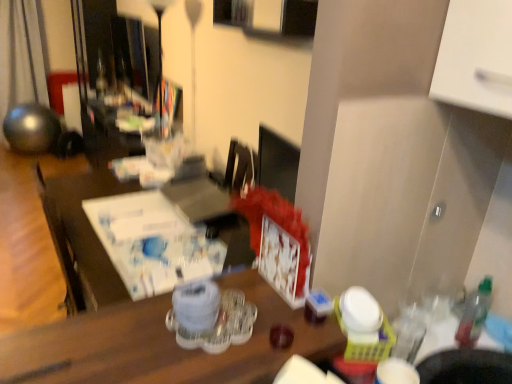
What do you see at coordinates (162, 345) in the screenshot?
I see `clear plastic tray at center` at bounding box center [162, 345].

Describe the element at coordinates (31, 128) in the screenshot. I see `metallic sphere at left` at that location.

Locate an element on the screen. The width and height of the screenshot is (512, 384). clear plastic tray at center is located at coordinates (162, 345).

Considering the relative sizes of translucent plastic bottle at right and white paper at center in the image provided, is translucent plastic bottle at right thinner than white paper at center?

Yes, translucent plastic bottle at right is thinner than white paper at center.

Would you say white paper at center is part of translucent plastic bottle at right's contents?

No, white paper at center is not inside translucent plastic bottle at right.

Looking at this image, from a real-world perspective, is translucent plastic bottle at right positioned above or below white paper at center?

Clearly, from a real-world perspective, translucent plastic bottle at right is above white paper at center.

How different are the orientations of translucent plastic bottle at right and white paper at center in degrees?

The angle between the facing direction of translucent plastic bottle at right and the facing direction of white paper at center is 168 degrees.

Which object is further away from the camera taking this photo, metallic sphere at left or white paper at center?

metallic sphere at left.

Between metallic sphere at left and white paper at center, which one has larger size?

Bigger between the two is metallic sphere at left.

From a real-world perspective, is metallic sphere at left positioned above or below white paper at center?

metallic sphere at left is below white paper at center.

You are a GUI agent. You are given a task and a screenshot of the screen. Output one action in this format:
    pyautogui.click(x=<x>, y=<y>)
    Task: Click on the ball behind the white paper at center
    Image resolution: width=512 pixels, height=384 pixels.
    Given the screenshot: What is the action you would take?
    pyautogui.click(x=31, y=128)

In terms of width, does white paper at center look wider or thinner when compared to metallic sphere at left?

Clearly, white paper at center has more width compared to metallic sphere at left.

From the image's perspective, relative to metallic sphere at left, is white paper at center above or below?

Based on their image positions, white paper at center is located beneath metallic sphere at left.

Would you say white paper at center is a long distance from metallic sphere at left?

That's right, there is a large distance between white paper at center and metallic sphere at left.

Which is behind, metallic sphere at left or translucent plastic bottle at right?

metallic sphere at left is further away from the camera.

Is metallic sphere at left thinner than translucent plastic bottle at right?

No, metallic sphere at left is not thinner than translucent plastic bottle at right.

Is metallic sphere at left turned away from translucent plastic bottle at right?

No, metallic sphere at left is not facing away from translucent plastic bottle at right.

Is translucent plastic bottle at right inside metallic sphere at left?

No, translucent plastic bottle at right is not inside metallic sphere at left.

Considering the relative positions of clear plastic tray at center and white paper at center in the image provided, is clear plastic tray at center behind white paper at center?

No, it is in front of white paper at center.

This screenshot has height=384, width=512. I want to click on table below the clear plastic tray at center (from a real-world perspective), so click(83, 237).

From the image's perspective, is clear plastic tray at center on white paper at center?

No, from the image's perspective, clear plastic tray at center is not on top of white paper at center.

From a real-world perspective, between clear plastic tray at center and white paper at center, who is vertically higher?

From a 3D spatial view, clear plastic tray at center is above.

Is metallic sphere at left taller or shorter than clear plastic tray at center?

Clearly, metallic sphere at left is taller compared to clear plastic tray at center.

How many degrees apart are the facing directions of metallic sphere at left and clear plastic tray at center?

The angle between the facing direction of metallic sphere at left and the facing direction of clear plastic tray at center is 90.9 degrees.

Is metallic sphere at left in front of or behind clear plastic tray at center in the image?

Clearly, metallic sphere at left is behind clear plastic tray at center.

Considering the positions of objects metallic sphere at left and clear plastic tray at center in the image provided, who is more to the right, metallic sphere at left or clear plastic tray at center?

From the viewer's perspective, clear plastic tray at center appears more on the right side.

Which of these two, clear plastic tray at center or translucent plastic bottle at right, is bigger?

Bigger between the two is clear plastic tray at center.

Where is `bottle beneath the clear plastic tray at center (from a real-world perspective)`? This screenshot has height=384, width=512. bottle beneath the clear plastic tray at center (from a real-world perspective) is located at coordinates (474, 314).

Between clear plastic tray at center and translucent plastic bottle at right, which one appears on the right side from the viewer's perspective?

From the viewer's perspective, translucent plastic bottle at right appears more on the right side.

Is the position of clear plastic tray at center more distant than that of translucent plastic bottle at right?

No, it is in front of translucent plastic bottle at right.

This screenshot has height=384, width=512. In the image, there is a white paper at center. Identify the location of bottle below it (from the image's perspective). (474, 314).

The height and width of the screenshot is (384, 512). Find the location of `ball directly beneath the white paper at center (from a real-world perspective)`. ball directly beneath the white paper at center (from a real-world perspective) is located at coordinates (31, 128).

When comparing their distances from translucent plastic bottle at right, does white paper at center or clear plastic tray at center seem closer?

Among the two, clear plastic tray at center is located nearer to translucent plastic bottle at right.

Considering their positions, is clear plastic tray at center positioned further to translucent plastic bottle at right than white paper at center?

white paper at center.

When comparing their distances from metallic sphere at left, does translucent plastic bottle at right or white paper at center seem closer?

Based on the image, white paper at center appears to be nearer to metallic sphere at left.

Estimate the real-world distances between objects in this image. Which object is closer to translucent plastic bottle at right, clear plastic tray at center or metallic sphere at left?

clear plastic tray at center is closer to translucent plastic bottle at right.

Looking at the image, which one is located closer to metallic sphere at left, translucent plastic bottle at right or clear plastic tray at center?

clear plastic tray at center lies closer to metallic sphere at left than the other object.

When comparing their distances from metallic sphere at left, does white paper at center or translucent plastic bottle at right seem closer?

white paper at center is closer to metallic sphere at left.

Which object lies further to the anchor point clear plastic tray at center, translucent plastic bottle at right or metallic sphere at left?

Among the two, metallic sphere at left is located further to clear plastic tray at center.

When comparing their distances from clear plastic tray at center, does metallic sphere at left or white paper at center seem closer?

The object closer to clear plastic tray at center is white paper at center.

Image resolution: width=512 pixels, height=384 pixels. I want to click on bottle positioned between clear plastic tray at center and metallic sphere at left from near to far, so click(474, 314).

At what (x,y) coordinates should I click in order to perform the action: click on table positioned between translucent plastic bottle at right and metallic sphere at left from near to far. Please return your answer as a coordinate pair (x, y). Image resolution: width=512 pixels, height=384 pixels. Looking at the image, I should click on (83, 237).

Identify the location of desk located between white paper at center and translucent plastic bottle at right in the left-right direction. (162, 345).

Find the location of a particular element. table between clear plastic tray at center and metallic sphere at left in the front-back direction is located at coordinates (83, 237).